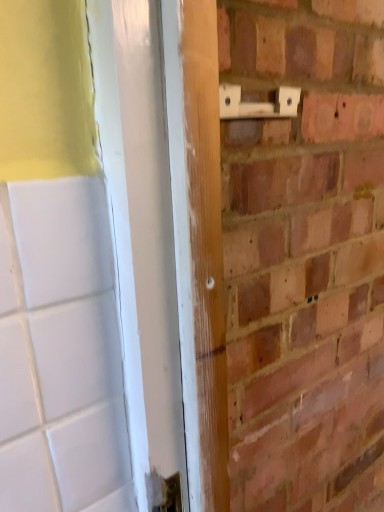
The image size is (384, 512). What do you see at coordinates (257, 103) in the screenshot? I see `white matte wood door handle at upper center` at bounding box center [257, 103].

You are a GUI agent. You are given a task and a screenshot of the screen. Output one action in this format:
    pyautogui.click(x=<x>, y=<y>)
    Task: Click on the white matte wood door handle at upper center
    Image resolution: width=384 pixels, height=512 pixels.
    Given the screenshot: What is the action you would take?
    (x=257, y=103)

Measure the distance between point [296,98] and camera.

The distance of point [296,98] from camera is 20.98 inches.

This screenshot has width=384, height=512. I want to click on white matte wood door handle at upper center, so click(x=257, y=103).